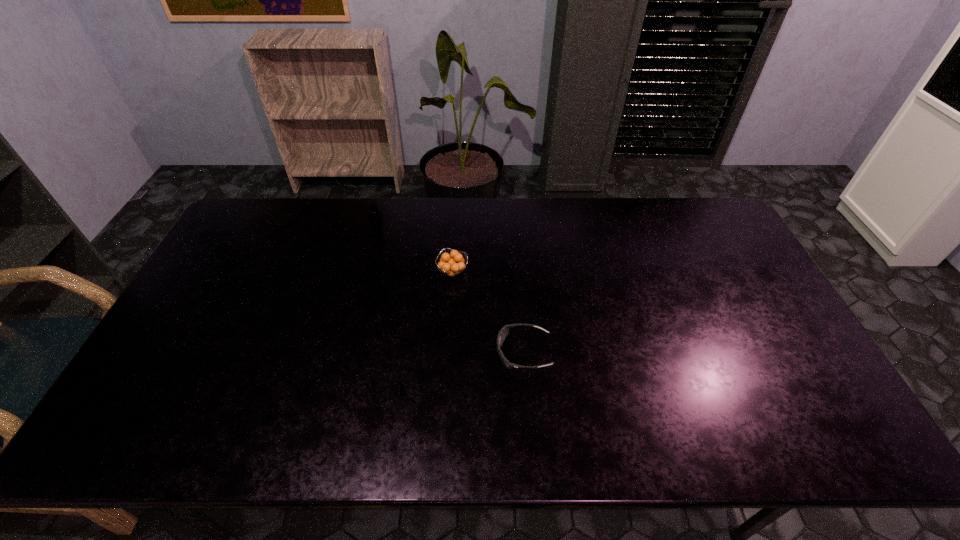
Identify the location of Lego. (375, 217).

Where is `the tallest object`? Image resolution: width=960 pixels, height=540 pixels. the tallest object is located at coordinates (375, 217).

Where is `the second shortest object`? This screenshot has height=540, width=960. the second shortest object is located at coordinates (453, 266).

The width and height of the screenshot is (960, 540). What are the coordinates of `the second nearest object` in the screenshot? It's located at (453, 266).

At what (x,y) coordinates should I click in order to perform the action: click on the nearest object. Please return your answer as a coordinate pair (x, y). This screenshot has height=540, width=960. Looking at the image, I should click on (504, 332).

Locate an element on the screen. This screenshot has height=540, width=960. goggles is located at coordinates (504, 332).

You are a GUI agent. You are given a task and a screenshot of the screen. Output one action in this format:
    pyautogui.click(x=<x>, y=<y>)
    Task: Click on the blank space located on the front-facing side of the Lego
    The width and height of the screenshot is (960, 540).
    Given the screenshot: What is the action you would take?
    353,320

This screenshot has width=960, height=540. I want to click on free region located on the right of the orange fruit, so click(x=543, y=272).

Where is `vacant area situated 0.170m on the lenses of the shortest object`? vacant area situated 0.170m on the lenses of the shortest object is located at coordinates (433, 352).

This screenshot has width=960, height=540. I want to click on vacant space located on the lenses of the shortest object, so click(x=377, y=352).